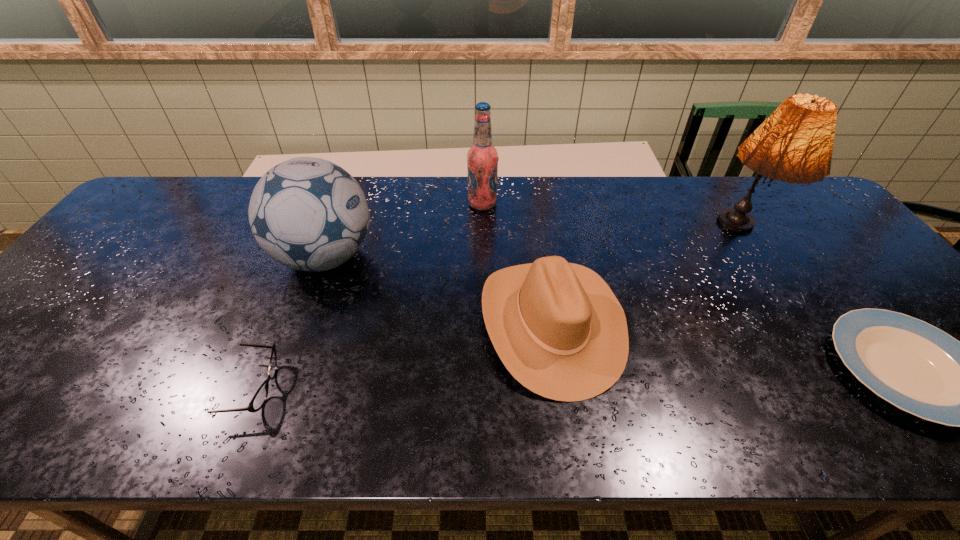
This screenshot has height=540, width=960. I want to click on lampshade situated at the far edge, so click(x=794, y=144).

I want to click on alcohol situated at the far edge, so click(x=482, y=157).

The image size is (960, 540). I want to click on cowboy hat that is at the near edge, so click(557, 327).

Image resolution: width=960 pixels, height=540 pixels. Find the location of `spectacles located in the near edge section of the desktop`. spectacles located in the near edge section of the desktop is located at coordinates (259, 399).

This screenshot has width=960, height=540. In the image, there is a desktop. Find the location of `free region at the far edge`. free region at the far edge is located at coordinates (662, 192).

The height and width of the screenshot is (540, 960). In order to click on vacant space at the near edge of the desktop in this screenshot , I will do `click(612, 431)`.

In the image, there is a desktop. Where is `vacant space at the left edge`? The height and width of the screenshot is (540, 960). vacant space at the left edge is located at coordinates (55, 359).

Find the location of a particular element. free space at the right edge of the desktop is located at coordinates (799, 235).

In the image, there is a desktop. Identify the location of vacant space at the far right corner. This screenshot has width=960, height=540. (799, 188).

Where is `free space between the lampshade and the soccer ball`? free space between the lampshade and the soccer ball is located at coordinates (x=532, y=247).